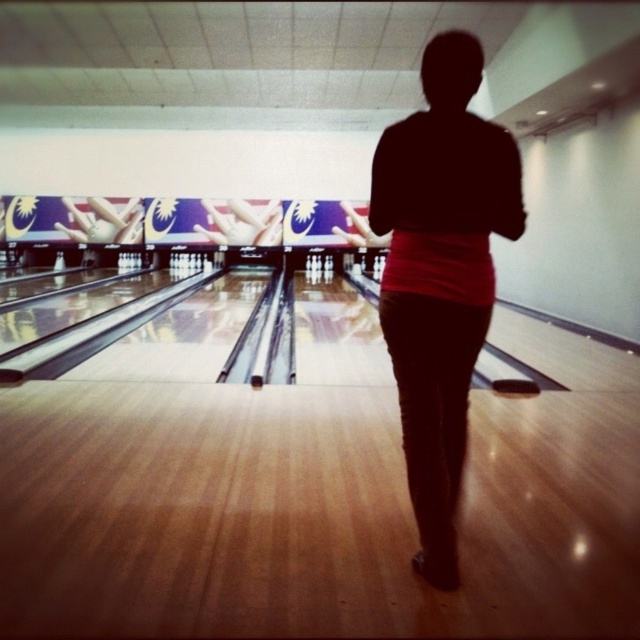
You are a bowler standing at the center of the lane and see the black matte shirt at center and the white matte bowling ball at center. You want to roll the ball to hit the pins at the end of the lane. Which object is closer to your current position?

The black matte shirt at center is closer to your current position because it is only 14.15 meters away from the white matte bowling ball at center, but the distance from you to each object isn

You are a photographer trying to capture the black matte shirt at center and the white matte bowling ball at center in a single shot. Since you want both objects to be clearly visible, which object should you focus on first to ensure proper exposure?

The black matte shirt at center is larger in size than the white matte bowling ball at center, so you should focus on the black matte shirt at center first to ensure proper exposure.

You are a photographer trying to capture the scene from above. You notice the black matte shirt at center and the white matte bowling ball at center. Which object is positioned lower in the image?

The black matte shirt at center is positioned lower than the white matte bowling ball at center in the image.